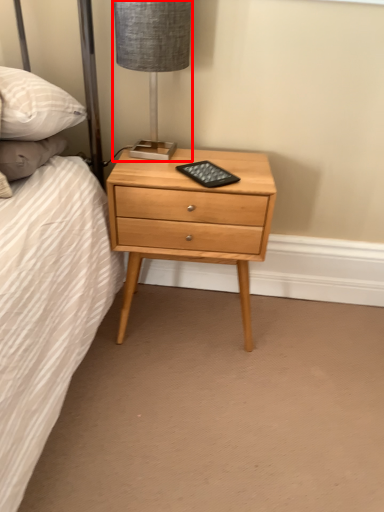
Question: In this image, where is table lamp (annotated by the red box) located relative to nightstand?

Choices:
 (A) right
 (B) left

Answer: (B)